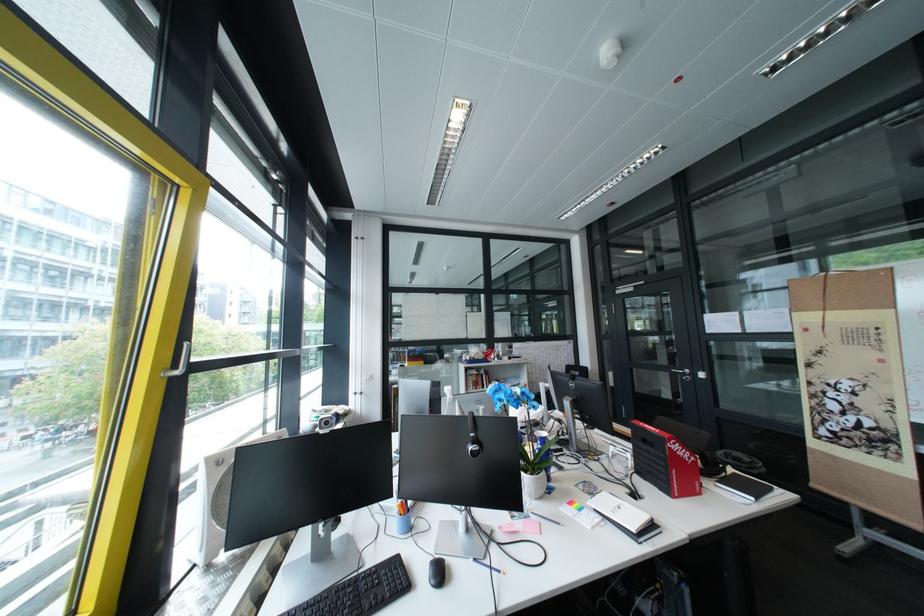
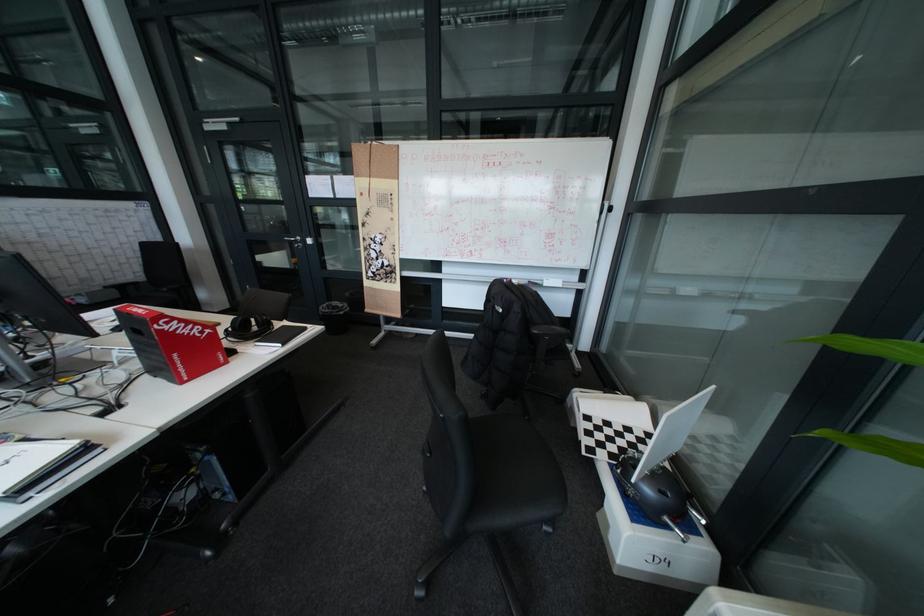
In the second image, find the point that corresponds to [738,451] in the first image.

(341, 304)